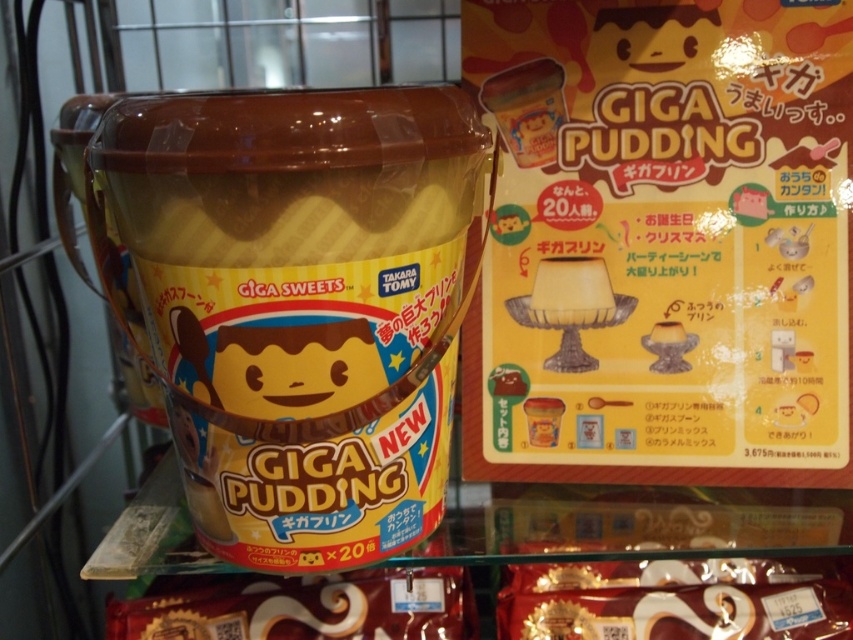
Question: Which of these objects is positioned farthest from the shiny chocolate bar at lower right?

Choices:
 (A) matte plastic pudding at center
 (B) matte yellow pudding at center

Answer: (A)

Question: Observing the image, what is the correct spatial positioning of matte yellow pudding at center in reference to shiny chocolate bar at lower right?

Choices:
 (A) below
 (B) above

Answer: (B)

Question: Can you confirm if matte plastic pudding at center is positioned to the right of shiny chocolate bar at lower right?

Choices:
 (A) yes
 (B) no

Answer: (B)

Question: Can you confirm if matte plastic pudding at center is positioned below shiny chocolate bar at lower right?

Choices:
 (A) no
 (B) yes

Answer: (A)

Question: Which object is the farthest from the shiny chocolate bar at lower right?

Choices:
 (A) matte yellow pudding at center
 (B) matte plastic pudding at center

Answer: (B)

Question: Based on their relative distances, which object is farther from the matte yellow pudding at center?

Choices:
 (A) matte plastic pudding at center
 (B) shiny chocolate bar at lower right

Answer: (A)